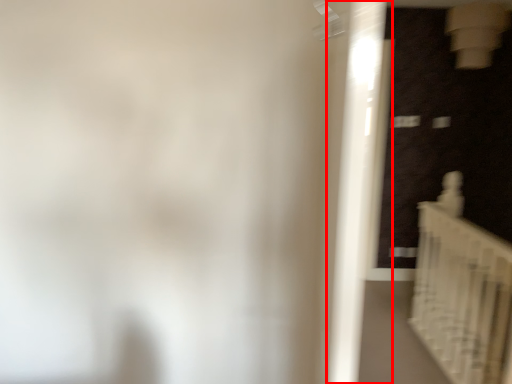
Question: Considering the relative positions of door (annotated by the red box) and stairs in the image provided, where is door (annotated by the red box) located with respect to the staircase?

Choices:
 (A) right
 (B) left

Answer: (B)